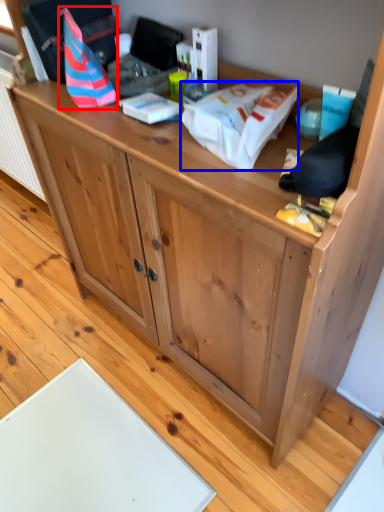
Question: Which object appears farthest to the camera in this image, kit (highlighted by a red box) or kit (highlighted by a blue box)?

Choices:
 (A) kit
 (B) kit

Answer: (A)